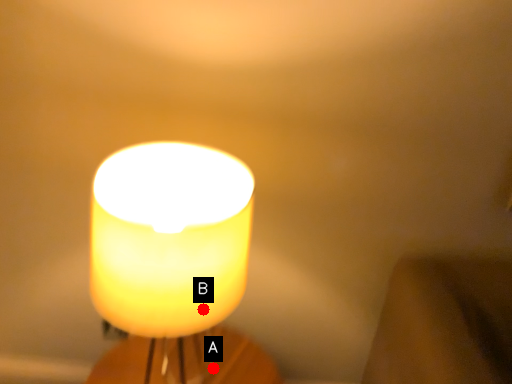
Question: Two points are circled on the image, labeled by A and B beside each circle. Which point appears farthest from the camera in this image?

Choices:
 (A) A is further
 (B) B is further

Answer: (A)